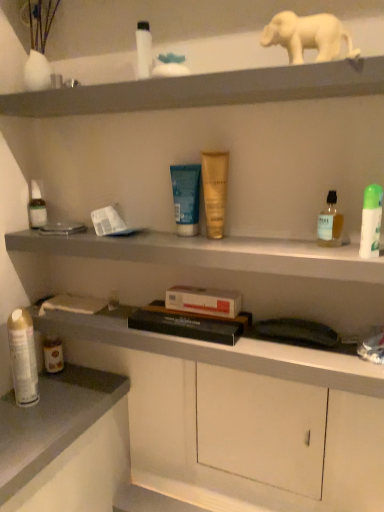
Question: Is hardcover book at center to the right of green plastic deodorant at right, which is counted as the first toiletry, starting from the front, from the viewer's perspective?

Choices:
 (A) yes
 (B) no

Answer: (B)

Question: Is hardcover book at center looking in the opposite direction of green plastic deodorant at right, which is counted as the first toiletry, starting from the front?

Choices:
 (A) yes
 (B) no

Answer: (B)

Question: Is hardcover book at center oriented towards green plastic deodorant at right, arranged as the sixth toiletry when viewed from the left?

Choices:
 (A) yes
 (B) no

Answer: (B)

Question: Is hardcover book at center beside green plastic deodorant at right, positioned as the first toiletry in right-to-left order?

Choices:
 (A) yes
 (B) no

Answer: (B)

Question: Is green plastic deodorant at right, which is counted as the first toiletry, starting from the front, inside hardcover book at center?

Choices:
 (A) no
 (B) yes

Answer: (A)

Question: Is hardcover book at center behind green plastic deodorant at right, positioned as the first toiletry in right-to-left order?

Choices:
 (A) yes
 (B) no

Answer: (A)

Question: From a real-world perspective, is matte gray cabinet at center below metallic silver spray can at lower left, the 2th toiletry viewed from the back?

Choices:
 (A) yes
 (B) no

Answer: (B)

Question: Is matte gray cabinet at center oriented towards metallic silver spray can at lower left, the 2th toiletry viewed from the back?

Choices:
 (A) yes
 (B) no

Answer: (B)

Question: From the image's perspective, is matte gray cabinet at center under metallic silver spray can at lower left, which is the 5th toiletry from front to back?

Choices:
 (A) no
 (B) yes

Answer: (A)

Question: Is matte gray cabinet at center to the right of metallic silver spray can at lower left, positioned as the 2th toiletry in left-to-right order, from the viewer's perspective?

Choices:
 (A) yes
 (B) no

Answer: (A)

Question: Would you say matte gray cabinet at center contains metallic silver spray can at lower left, which is counted as the 5th toiletry, starting from the right?

Choices:
 (A) yes
 (B) no

Answer: (B)

Question: From a real-world perspective, is matte gray cabinet at center positioned over metallic silver spray can at lower left, the 2th toiletry viewed from the back, based on gravity?

Choices:
 (A) no
 (B) yes

Answer: (B)

Question: Can we say matte gray cabinet at center lies outside translucent plastic bottle at left, arranged as the first toiletry when viewed from the back?

Choices:
 (A) yes
 (B) no

Answer: (A)